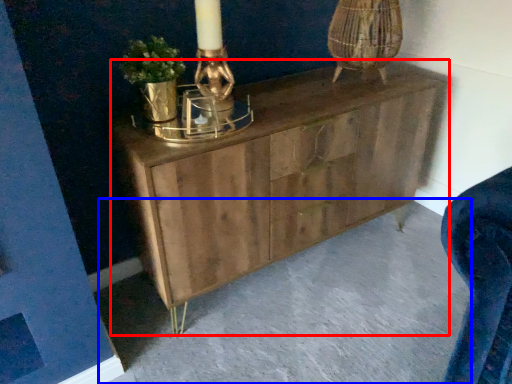
Question: Which point is further to the camera, chest of drawers (highlighted by a red box) or concrete (highlighted by a blue box)?

Choices:
 (A) chest of drawers
 (B) concrete

Answer: (A)